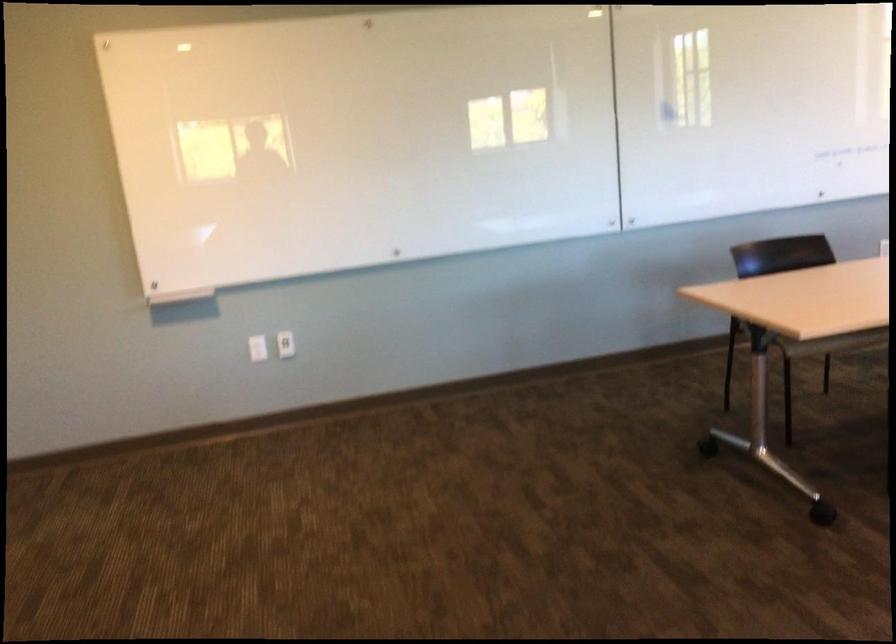
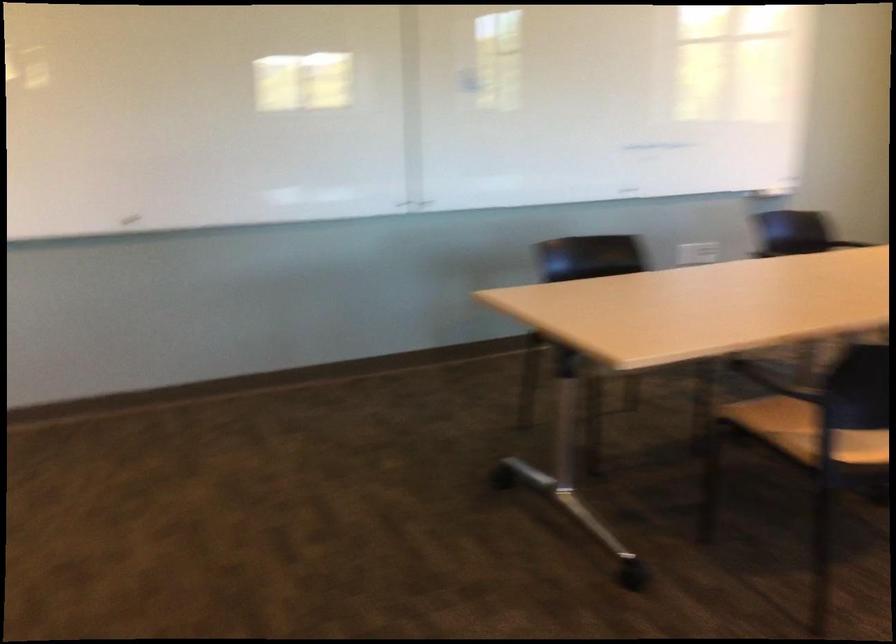
Question: How did the camera likely rotate?

Choices:
 (A) Left
 (B) Right
 (C) Up
 (D) Down

Answer: (B)